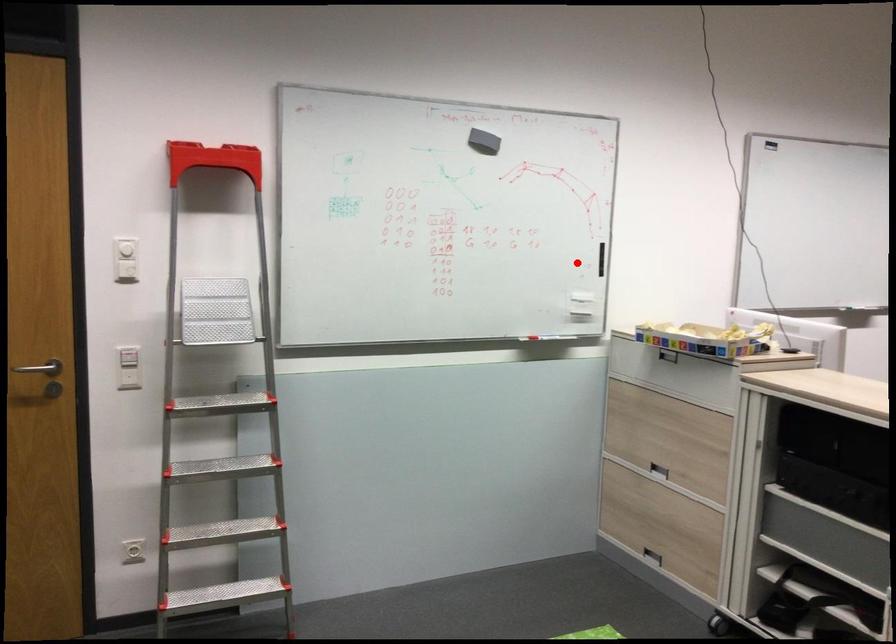
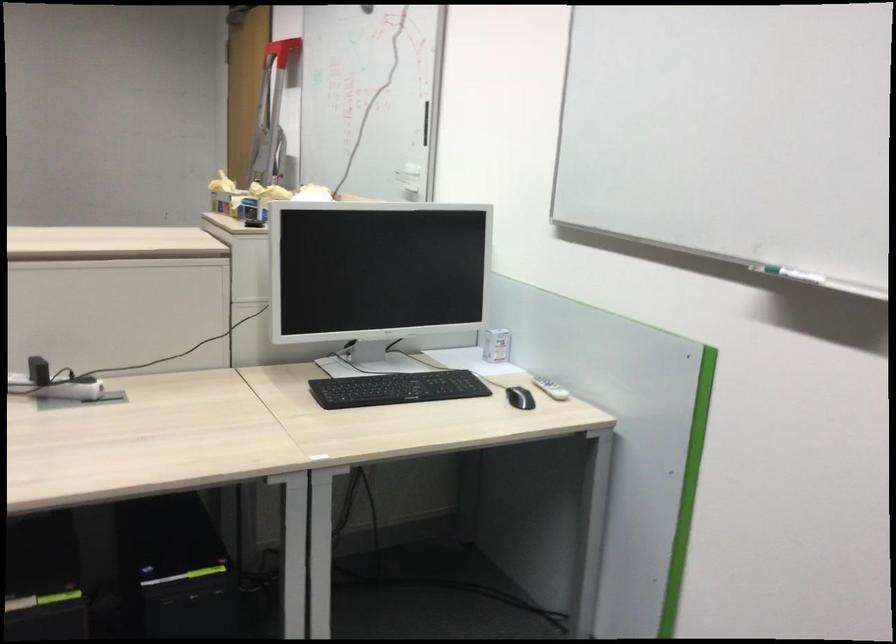
The point at the highlighted location is marked in the first image. Where is the corresponding point in the second image?

(426, 122)